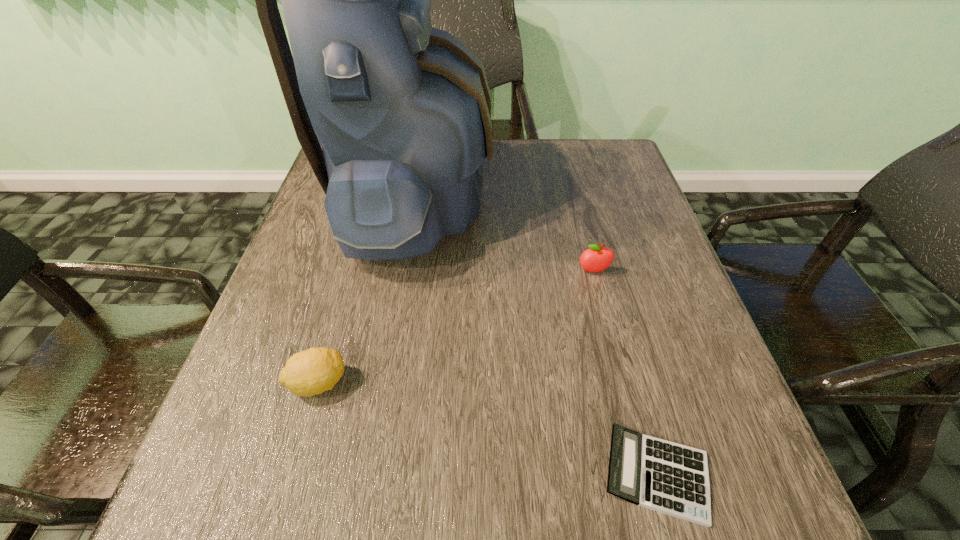
The width and height of the screenshot is (960, 540). What are the coordinates of `vacant space that satisfies the following two spatial constraints: 1. at the stem end of the shortest object; 2. on the right side of the second nearest object` in the screenshot? It's located at (292, 475).

The image size is (960, 540). I want to click on free location that satisfies the following two spatial constraints: 1. at the front pocket of the tallest object; 2. on the back side of the calculator, so click(368, 475).

The height and width of the screenshot is (540, 960). In order to click on free space that satisfies the following two spatial constraints: 1. at the front pocket of the backpack; 2. on the right side of the apple in this screenshot , I will do `click(402, 271)`.

Find the location of a particular element. This screenshot has width=960, height=540. vacant region that satisfies the following two spatial constraints: 1. at the front pocket of the backpack; 2. on the back side of the apple is located at coordinates (402, 271).